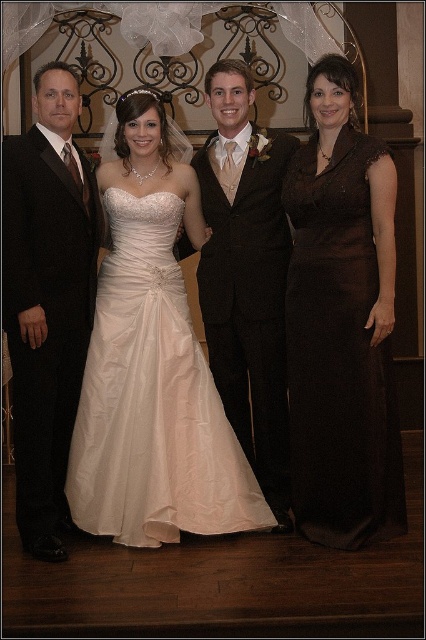
Question: Does black satin suit at left appear on the right side of satin black suit at center?

Choices:
 (A) yes
 (B) no

Answer: (B)

Question: Does ivory satin wedding dress at center appear under brown satin dress at right?

Choices:
 (A) yes
 (B) no

Answer: (A)

Question: Which point is farther to the camera?

Choices:
 (A) (273, 193)
 (B) (32, 340)

Answer: (A)

Question: Which of the following is the farthest from the observer?

Choices:
 (A) (221, 218)
 (B) (14, 337)

Answer: (A)

Question: Which point appears closest to the camera in this image?

Choices:
 (A) (22, 381)
 (B) (279, 376)
 (C) (115, 378)

Answer: (A)

Question: Is ivory satin wedding dress at center thinner than brown satin dress at right?

Choices:
 (A) no
 (B) yes

Answer: (A)